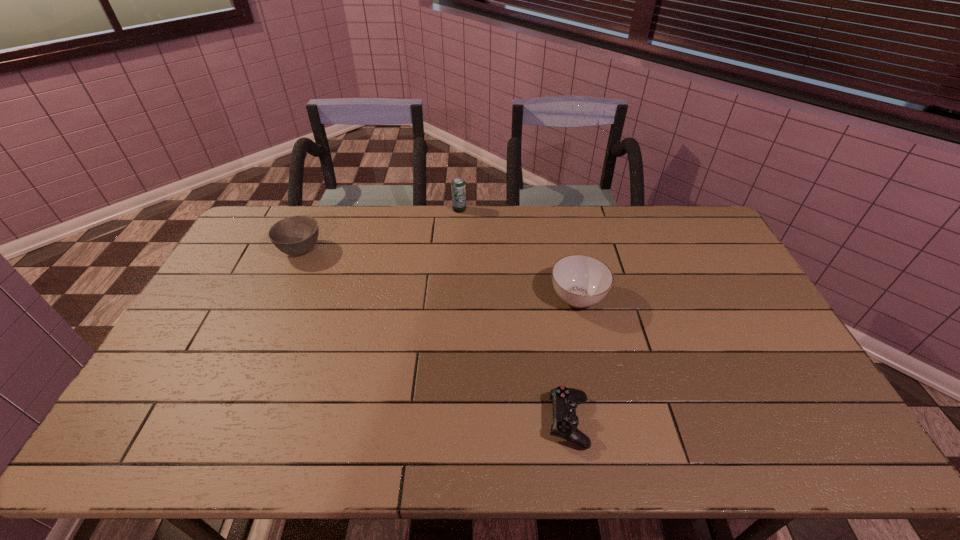
The height and width of the screenshot is (540, 960). Find the location of `free spot located on the left of the nearest object`. free spot located on the left of the nearest object is located at coordinates (482, 422).

Image resolution: width=960 pixels, height=540 pixels. What are the coordinates of `beer can that is at the far edge` in the screenshot? It's located at coord(458,187).

In order to click on bowl present at the far edge in this screenshot , I will do `click(296, 235)`.

You are a GUI agent. You are given a task and a screenshot of the screen. Output one action in this format:
    pyautogui.click(x=<x>, y=<y>)
    Task: Click on the object located at the near edge
    The image size is (960, 540).
    Given the screenshot: What is the action you would take?
    pyautogui.click(x=565, y=400)

At what (x,y) coordinates should I click in order to perform the action: click on object located at the left edge. Please return your answer as a coordinate pair (x, y). This screenshot has height=540, width=960. Looking at the image, I should click on (296, 235).

Where is `object that is at the far left corner`? object that is at the far left corner is located at coordinates (296, 235).

Locate an element on the screen. vacant region at the far edge of the desktop is located at coordinates (391, 208).

This screenshot has width=960, height=540. Identify the location of free space at the near edge. (442, 448).

The width and height of the screenshot is (960, 540). Identify the location of blank space at the far right corner of the desktop. (708, 222).

The height and width of the screenshot is (540, 960). Identify the location of vacant space at the near right corner of the desktop. (834, 427).